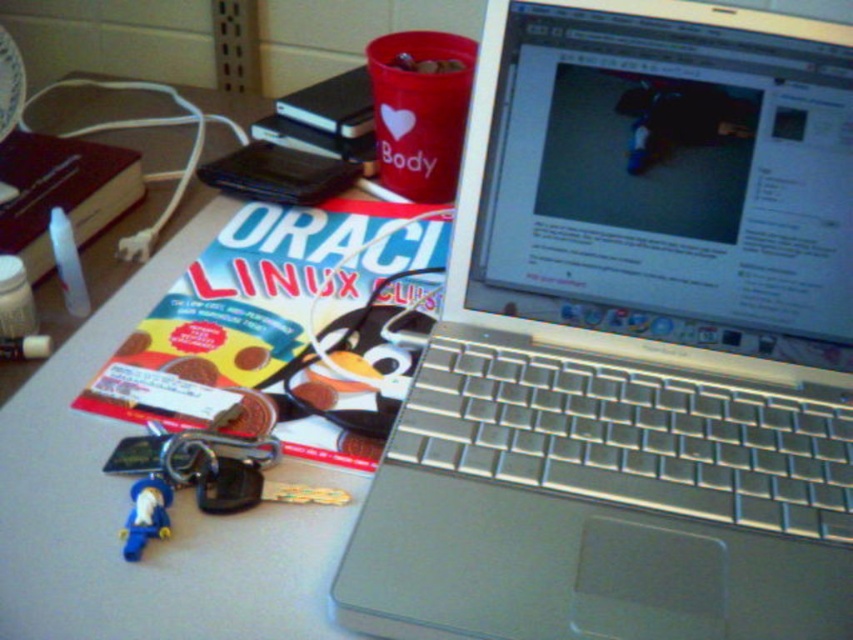
Question: Is silver metallic laptop at center thinner than blue plastic toy at lower left?

Choices:
 (A) no
 (B) yes

Answer: (A)

Question: Does silver metallic laptop at center appear on the left side of blue plastic toy at lower left?

Choices:
 (A) yes
 (B) no

Answer: (B)

Question: Which point is closer to the camera taking this photo?

Choices:
 (A) (703, 396)
 (B) (140, 490)

Answer: (B)

Question: Which of the following is the closest to the observer?

Choices:
 (A) blue plastic toy at lower left
 (B) silver metallic laptop at center

Answer: (B)

Question: Considering the relative positions of silver metallic laptop at center and blue plastic toy at lower left in the image provided, where is silver metallic laptop at center located with respect to blue plastic toy at lower left?

Choices:
 (A) below
 (B) above

Answer: (B)